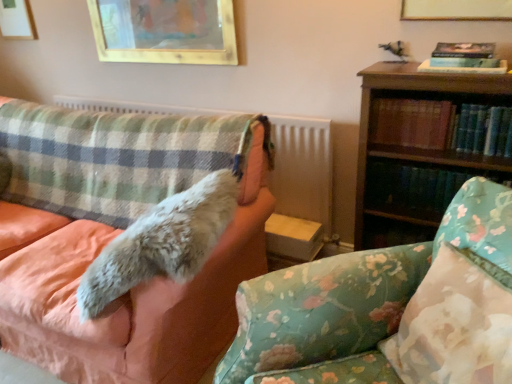
Locate an element on the screen. The height and width of the screenshot is (384, 512). fluffy white fur at left is located at coordinates (162, 242).

This screenshot has width=512, height=384. Identify the location of hardcover book at right, the first book when ordered from bottom to top. 416,188.

How much space does wooden picture frame at upper left, marked as the third picture frame in a right-to-left arrangement, occupy horizontally?

The width of wooden picture frame at upper left, marked as the third picture frame in a right-to-left arrangement, is 1.33 inches.

How much space does wooden picture frame at upper left, the first picture frame viewed from the back, occupy vertically?

It is 17.53 inches.

Where is `fluffy fabric couch at center, the 2th studio couch viewed from the right`? The width and height of the screenshot is (512, 384). fluffy fabric couch at center, the 2th studio couch viewed from the right is located at coordinates (132, 299).

What are the coordinates of `fluffy white fur at left` in the screenshot? It's located at (162, 242).

Based on the photo, is hardcover book at upper right, the first book viewed from the top, facing towards plaid fabric radiator at left?

No, hardcover book at upper right, the first book viewed from the top, does not turn towards plaid fabric radiator at left.

Which is closer, [504,69] or [277,188]?

Clearly, point [504,69] is closer to the camera than point [277,188].

Looking at this image, considering the positions of objects hardcover book at upper right, the third book in the bottom-to-top sequence, and plaid fabric radiator at left in the image provided, who is behind, hardcover book at upper right, the third book in the bottom-to-top sequence, or plaid fabric radiator at left?

plaid fabric radiator at left is more distant.

Who is taller, hardcover book at upper right, the third book in the bottom-to-top sequence, or plaid fabric radiator at left?

With more height is plaid fabric radiator at left.

Which is farther, (189, 378) or (163, 52)?

The point (163, 52) is behind.

Is fluffy fabric couch at center, which ranks as the first studio couch in left-to-right order, not near gold-framed picture at upper center, the second picture frame viewed from the left?

fluffy fabric couch at center, which ranks as the first studio couch in left-to-right order, is positioned a significant distance from gold-framed picture at upper center, the second picture frame viewed from the left.

From the image's perspective, starting from the fluffy fabric couch at center, which ranks as the first studio couch in left-to-right order, which picture frame is the 2nd one above? Please provide its 2D coordinates.

[(165, 31)]

Looking at this image, would you consider wooden bookshelf at right to be distant from hardcover book at right, the 3th book in the top-to-bottom sequence?

wooden bookshelf at right is near hardcover book at right, the 3th book in the top-to-bottom sequence, not far away.

Does wooden bookshelf at right lie behind hardcover book at right, the first book when ordered from bottom to top?

No, it is in front of hardcover book at right, the first book when ordered from bottom to top.

Looking at the image, does wooden bookshelf at right seem bigger or smaller compared to hardcover book at right, the 3th book in the top-to-bottom sequence?

wooden bookshelf at right is bigger than hardcover book at right, the 3th book in the top-to-bottom sequence.

Which is less distant, (391,87) or (393,204)?

The point (391,87) is closer to the camera.

Can you confirm if gold-framed picture at upper center, marked as the 3th picture frame in a left-to-right arrangement, is bigger than fluffy white fur at left?

Incorrect, gold-framed picture at upper center, marked as the 3th picture frame in a left-to-right arrangement, is not larger than fluffy white fur at left.

What's the angular difference between gold-framed picture at upper center, the third picture frame from the back, and fluffy white fur at left's facing directions?

The angular difference between gold-framed picture at upper center, the third picture frame from the back, and fluffy white fur at left is 11.3 degrees.

Is gold-framed picture at upper center, the third picture frame from the back, spatially inside fluffy white fur at left, or outside of it?

gold-framed picture at upper center, the third picture frame from the back, is not inside fluffy white fur at left, it's outside.

Is point (459, 0) closer to viewer compared to point (127, 251)?

No.

Considering the sizes of wooden picture frame at upper left, marked as the third picture frame in a right-to-left arrangement, and plaid fabric radiator at left in the image, is wooden picture frame at upper left, marked as the third picture frame in a right-to-left arrangement, taller or shorter than plaid fabric radiator at left?

wooden picture frame at upper left, marked as the third picture frame in a right-to-left arrangement, is shorter than plaid fabric radiator at left.

From a real-world perspective, is wooden picture frame at upper left, marked as the third picture frame in a right-to-left arrangement, positioned over plaid fabric radiator at left based on gravity?

Indeed, from a real-world perspective, wooden picture frame at upper left, marked as the third picture frame in a right-to-left arrangement, stands above plaid fabric radiator at left.

Is wooden picture frame at upper left, which ranks as the 1th picture frame in left-to-right order, oriented away from plaid fabric radiator at left?

wooden picture frame at upper left, which ranks as the 1th picture frame in left-to-right order, does not have its back to plaid fabric radiator at left.

Considering the sizes of wooden picture frame at upper left, the first picture frame viewed from the back, and plaid fabric radiator at left in the image, is wooden picture frame at upper left, the first picture frame viewed from the back, bigger or smaller than plaid fabric radiator at left?

wooden picture frame at upper left, the first picture frame viewed from the back, is smaller than plaid fabric radiator at left.

Is plaid fabric radiator at left positioned with its back to wooden bookshelf at right?

No, plaid fabric radiator at left is not facing away from wooden bookshelf at right.

Looking at their sizes, would you say plaid fabric radiator at left is wider or thinner than wooden bookshelf at right?

Considering their sizes, plaid fabric radiator at left looks broader than wooden bookshelf at right.

Which object is further away from the camera, plaid fabric radiator at left or wooden bookshelf at right?

plaid fabric radiator at left is behind.

From a real-world perspective, who is located lower, plaid fabric radiator at left or wooden bookshelf at right?

From a 3D spatial view, wooden bookshelf at right is below.

Is wooden bookshelf at right not close to fluffy white fur at left?

No.

Is wooden bookshelf at right aimed at fluffy white fur at left?

No.

Does point (467, 90) lie behind point (197, 263)?

That is True.

Find the location of a particular element. This screenshot has width=512, height=384. the 2nd book positioned above the plaid fabric radiator at left (from the image's perspective) is located at coordinates (464, 59).

Find the location of a particular element. studio couch on the left of the gold-framed picture at upper center, the 2th picture frame in the front-to-back sequence is located at coordinates (132, 299).

Looking at the image, which one is located closer to gold-framed picture at upper center, the 2th picture frame in the front-to-back sequence, gold-framed picture at upper center, marked as the 3th picture frame in a left-to-right arrangement, or hardcover book at upper right, the first book viewed from the top?

gold-framed picture at upper center, marked as the 3th picture frame in a left-to-right arrangement, is positioned closer to the anchor gold-framed picture at upper center, the 2th picture frame in the front-to-back sequence.

Based on their spatial positions, is hardcover book at right, the 3th book in the top-to-bottom sequence, or wooden bookshelf at right closer to hardcover book at right, which appears as the second book when ordered from the bottom?

Among the two, wooden bookshelf at right is located nearer to hardcover book at right, which appears as the second book when ordered from the bottom.

From the image, which object appears to be nearer to floral fabric couch at center, which is the second studio couch in left-to-right order, plaid fabric radiator at left or hardcover book at right, the second book when ordered from top to bottom?

hardcover book at right, the second book when ordered from top to bottom, is positioned closer to the anchor floral fabric couch at center, which is the second studio couch in left-to-right order.

When comparing their distances from floral fabric pillow at lower right, does hardcover book at right, the 3th book in the top-to-bottom sequence, or floral fabric couch at center, which is the second studio couch in left-to-right order, seem further?

hardcover book at right, the 3th book in the top-to-bottom sequence, is positioned further to the anchor floral fabric pillow at lower right.

Which object lies nearer to the anchor point fluffy white fur at left, floral fabric pillow at lower right or wooden bookshelf at right?

Among the two, floral fabric pillow at lower right is located nearer to fluffy white fur at left.

Looking at the image, which one is located further to floral fabric pillow at lower right, wooden picture frame at upper left, which ranks as the 1th picture frame in left-to-right order, or gold-framed picture at upper center, which appears as the 1th picture frame when viewed from the right?

wooden picture frame at upper left, which ranks as the 1th picture frame in left-to-right order, is positioned further to the anchor floral fabric pillow at lower right.

Based on the photo, from the image, which object appears to be farther from fluffy white fur at left, wooden picture frame at upper left, marked as the third picture frame in a right-to-left arrangement, or gold-framed picture at upper center, arranged as the first picture frame when viewed from the front?

Among the two, wooden picture frame at upper left, marked as the third picture frame in a right-to-left arrangement, is located further to fluffy white fur at left.

Looking at the image, which one is located further to wooden picture frame at upper left, the 3th picture frame in the front-to-back sequence, floral fabric pillow at lower right or fluffy white fur at left?

floral fabric pillow at lower right is positioned further to the anchor wooden picture frame at upper left, the 3th picture frame in the front-to-back sequence.

Locate an element on the screen. studio couch between plaid fabric radiator at left and floral fabric pillow at lower right is located at coordinates (388, 308).

Find the location of a particular element. This screenshot has width=512, height=384. pillow positioned between floral fabric couch at center, which is the second studio couch in left-to-right order, and wooden bookshelf at right from near to far is located at coordinates (454, 326).

Where is `picture frame located between fluffy fabric couch at center, which ranks as the first studio couch in left-to-right order, and floral fabric pillow at lower right in the left-right direction`? The height and width of the screenshot is (384, 512). picture frame located between fluffy fabric couch at center, which ranks as the first studio couch in left-to-right order, and floral fabric pillow at lower right in the left-right direction is located at coordinates tap(165, 31).

Find the location of a particular element. This screenshot has height=384, width=512. pillow between plaid fabric radiator at left and hardcover book at right, the second book when ordered from top to bottom, from left to right is located at coordinates (454, 326).